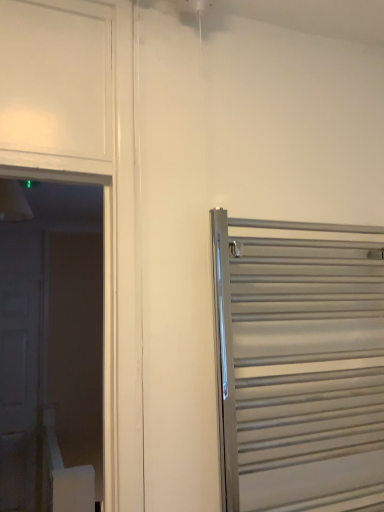
Question: Would you say satin silver towel rack at right, which is the first door in front-to-back order, is inside or outside white matte door at left, the second door positioned from the front?

Choices:
 (A) inside
 (B) outside

Answer: (B)

Question: In terms of width, does satin silver towel rack at right, marked as the 1th door in a right-to-left arrangement, look wider or thinner when compared to white matte door at left, the 1th door viewed from the back?

Choices:
 (A) thin
 (B) wide

Answer: (B)

Question: Is satin silver towel rack at right, arranged as the second door when viewed from the back, to the left or to the right of white matte door at left, the 1th door viewed from the back, in the image?

Choices:
 (A) left
 (B) right

Answer: (B)

Question: Is white matte door at left, the 1th door viewed from the back, in front of or behind satin silver towel rack at right, arranged as the second door when viewed from the back, in the image?

Choices:
 (A) behind
 (B) front

Answer: (A)

Question: Considering the positions of white matte door at left, the second door positioned from the front, and satin silver towel rack at right, which is the first door in front-to-back order, in the image, is white matte door at left, the second door positioned from the front, wider or thinner than satin silver towel rack at right, which is the first door in front-to-back order,?

Choices:
 (A) wide
 (B) thin

Answer: (B)

Question: Is white matte door at left, the second door positioned from the front, taller or shorter than satin silver towel rack at right, which is the first door in front-to-back order?

Choices:
 (A) tall
 (B) short

Answer: (A)

Question: Is white matte door at left, positioned as the 1th door in left-to-right order, inside or outside of satin silver towel rack at right, arranged as the second door when viewed from the back?

Choices:
 (A) outside
 (B) inside

Answer: (A)